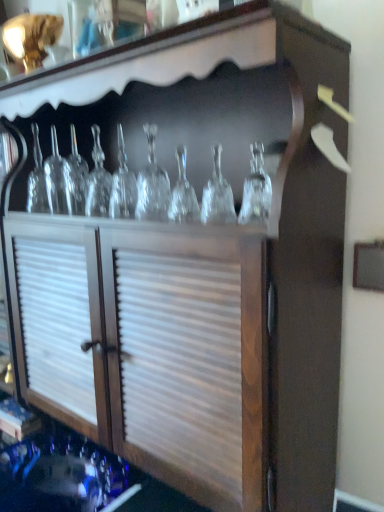
Question: Should I look upward or downward to see clear glass bottle at left, marked as the second glass bottle in a right-to-left arrangement?

Choices:
 (A) down
 (B) up

Answer: (B)

Question: Which direction should I rotate to face transparent glass wine glass at center, which is the second glass bottle from back to front, — up or down?

Choices:
 (A) down
 (B) up

Answer: (B)

Question: Is clear glass bottle at left, acting as the first glass bottle starting from the back, positioned in front of transparent glass wine glass at center, which is the 1th glass bottle in right-to-left order?

Choices:
 (A) no
 (B) yes

Answer: (A)

Question: From the image's perspective, would you say clear glass bottle at left, acting as the first glass bottle starting from the back, is positioned over transparent glass wine glass at center, which is the second glass bottle from back to front?

Choices:
 (A) no
 (B) yes

Answer: (B)

Question: From a real-world perspective, is clear glass bottle at left, marked as the second glass bottle in a right-to-left arrangement, physically below transparent glass wine glass at center, which is the second glass bottle from back to front?

Choices:
 (A) no
 (B) yes

Answer: (A)

Question: Is clear glass bottle at left, the first glass bottle in the left-to-right sequence, shorter than transparent glass wine glass at center, which is the second glass bottle from back to front?

Choices:
 (A) no
 (B) yes

Answer: (B)

Question: Considering the relative positions of clear glass bottle at left, acting as the first glass bottle starting from the back, and transparent glass wine glass at center, acting as the first glass bottle starting from the front, in the image provided, is clear glass bottle at left, acting as the first glass bottle starting from the back, behind transparent glass wine glass at center, acting as the first glass bottle starting from the front,?

Choices:
 (A) yes
 (B) no

Answer: (A)

Question: Is clear glass bottle at left, acting as the first glass bottle starting from the back, taller than transparent glass wine glass at center, which is the 1th glass bottle in right-to-left order?

Choices:
 (A) yes
 (B) no

Answer: (B)

Question: Is transparent glass wine glass at center, which is the second glass bottle from left to right, turned away from clear glass bottle at left, the first glass bottle in the left-to-right sequence?

Choices:
 (A) yes
 (B) no

Answer: (B)

Question: Is transparent glass wine glass at center, which is the second glass bottle from left to right, at the left side of clear glass bottle at left, acting as the first glass bottle starting from the back?

Choices:
 (A) no
 (B) yes

Answer: (A)

Question: Is transparent glass wine glass at center, acting as the first glass bottle starting from the front, outside clear glass bottle at left, marked as the second glass bottle in a right-to-left arrangement?

Choices:
 (A) no
 (B) yes

Answer: (B)

Question: From a real-world perspective, is transparent glass wine glass at center, which is the second glass bottle from left to right, beneath clear glass bottle at left, which is the 2th glass bottle from front to back?

Choices:
 (A) no
 (B) yes

Answer: (B)

Question: From the image's perspective, would you say transparent glass wine glass at center, which is the second glass bottle from back to front, is positioned over clear glass bottle at left, which is the 2th glass bottle from front to back?

Choices:
 (A) yes
 (B) no

Answer: (B)

Question: Can you confirm if transparent glass wine glass at center, which is the second glass bottle from left to right, is positioned to the right of clear glass bottle at left, the first glass bottle in the left-to-right sequence?

Choices:
 (A) no
 (B) yes

Answer: (B)

Question: Is transparent glass wine glass at center, which is the second glass bottle from left to right, wider or thinner than clear glass bottle at left, which is the 2th glass bottle from front to back?

Choices:
 (A) wide
 (B) thin

Answer: (B)